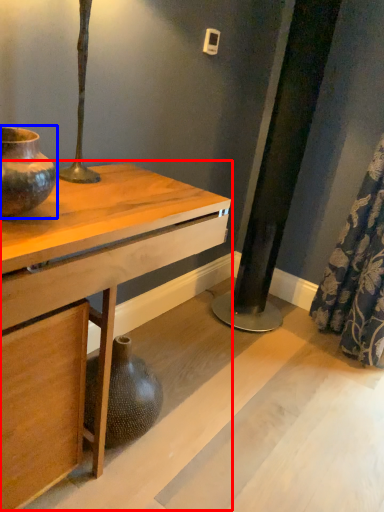
Question: Among these objects, which one is farthest to the camera, table (highlighted by a red box) or vase (highlighted by a blue box)?

Choices:
 (A) table
 (B) vase

Answer: (B)